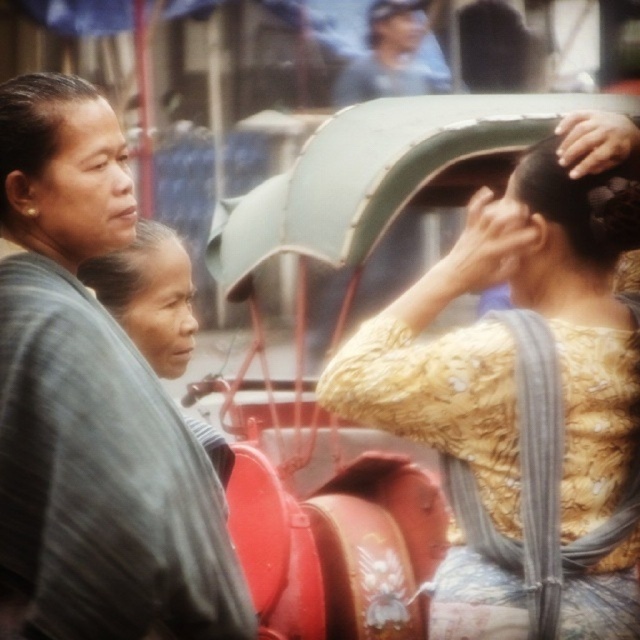
Question: Is the position of yellow textured blouse at center more distant than that of matte gray head at upper left?

Choices:
 (A) yes
 (B) no

Answer: (B)

Question: Which object appears farthest from the camera in this image?

Choices:
 (A) matte blue shirt at upper center
 (B) smooth skin head at upper center
 (C) matte gray head at center
 (D) matte gray jacket at left

Answer: (B)

Question: Which of these objects is positioned farthest from the matte gray jacket at left?

Choices:
 (A) smooth skin head at upper center
 (B) golden textured hair at upper right
 (C) matte gray head at upper left
 (D) yellow textured blouse at center

Answer: (A)

Question: Which of the following is the closest to the observer?

Choices:
 (A) (72, 280)
 (B) (557, 368)
 (C) (412, 80)
 (D) (144, 280)

Answer: (B)

Question: Can you confirm if yellow textured blouse at center is bigger than matte gray head at upper left?

Choices:
 (A) yes
 (B) no

Answer: (A)

Question: Can you confirm if matte gray head at upper left is wider than smooth skin head at upper center?

Choices:
 (A) no
 (B) yes

Answer: (B)